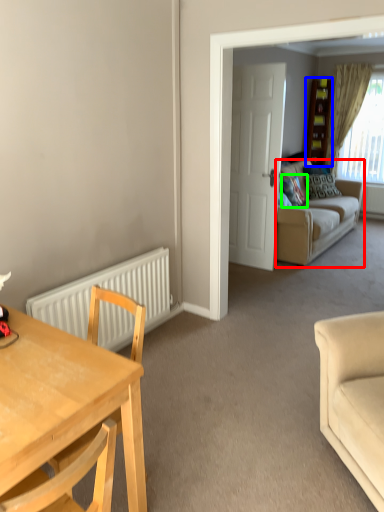
Question: Estimate the real-world distances between objects in this image. Which object is farther from studio couch (highlighted by a red box), cabinetry (highlighted by a blue box) or pillow (highlighted by a green box)?

Choices:
 (A) cabinetry
 (B) pillow

Answer: (A)